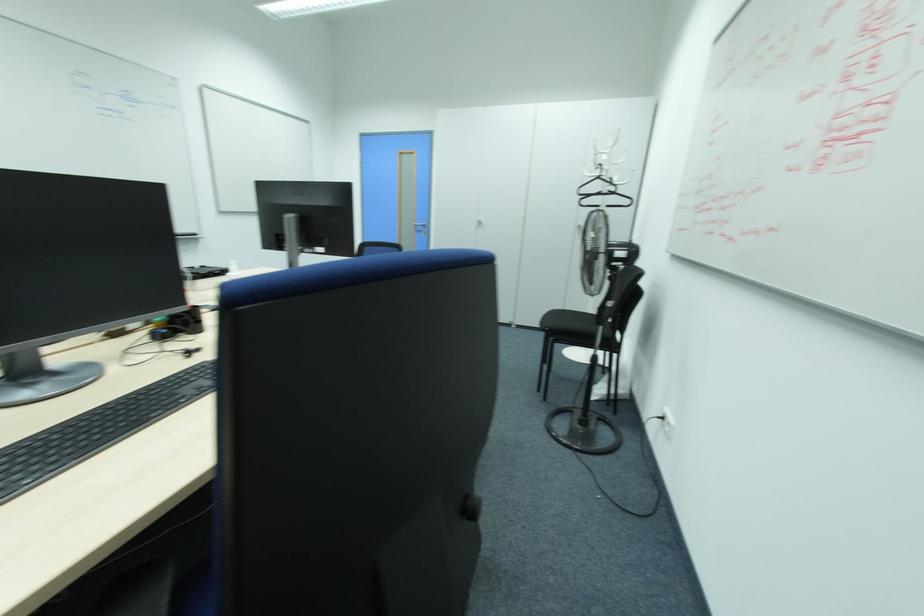
I want to click on metal door handle, so click(x=420, y=228).